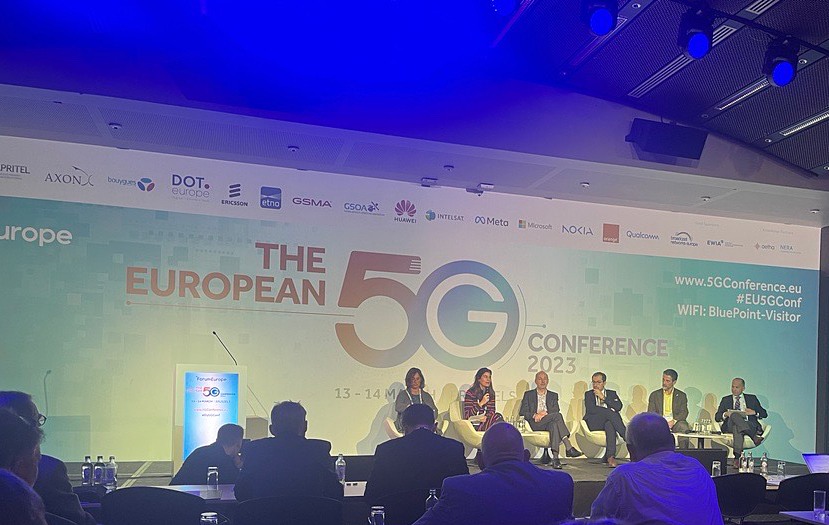
You are a GUI agent. You are given a task and a screenshot of the screen. Output one action in this format:
    pyautogui.click(x=<x>, y=<y>)
    Task: Click on the mounted speaker
    This screenshot has width=829, height=525.
    Given the screenshot: What is the action you would take?
    pyautogui.click(x=655, y=136)